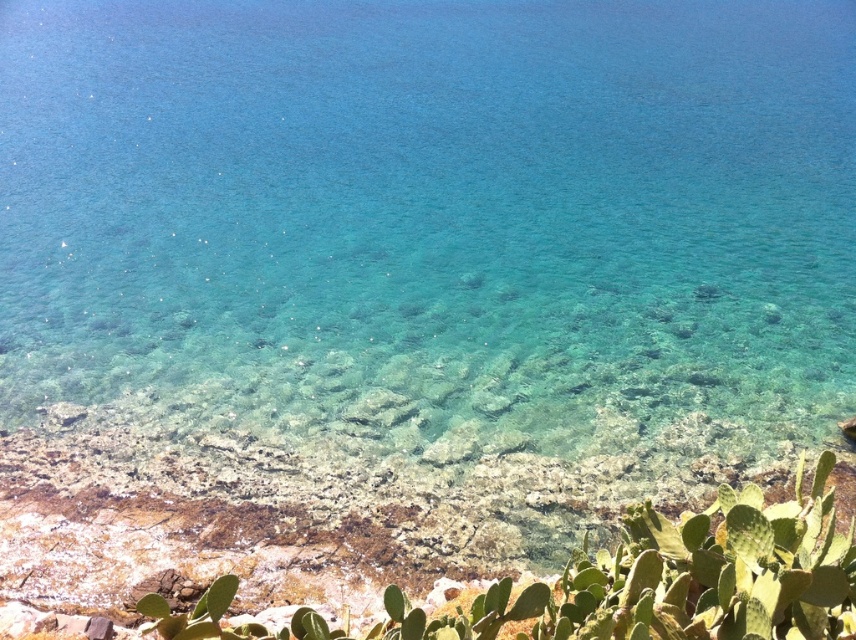
You are standing at the shoreline looking out at the turquoise water. There is a point marked at coordinates (431, 221). Based on the scene description, what does this point represent?

The point at (431, 221) represents the location of clear water at center as described in the scene.

You are standing on the rocky shoreline and want to reach the green succulent at lower right without getting wet. The clear water at center is in your way. Can you walk around it? Please explain your reasoning.

The clear water at center is 96.97 meters away from the green succulent at lower right. Since the distance is quite large, you would need to walk around the water, but the rocky shoreline might provide a path. However, the exact navigability depends on the terrain not described here.